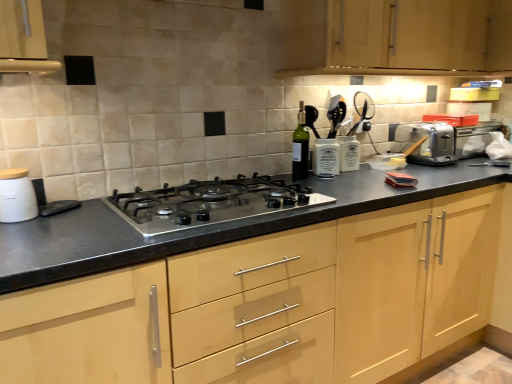
Identify the location of vacant area that lies to the right of green glass bottle at center. The height and width of the screenshot is (384, 512). (322, 176).